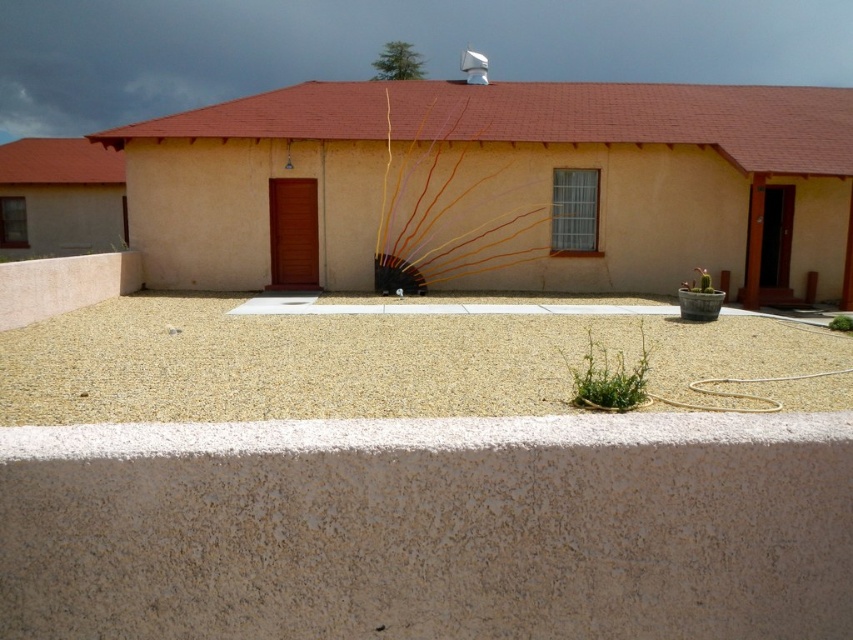
Question: Which point is farther from the camera taking this photo?

Choices:
 (A) (711, 285)
 (B) (842, 314)
 (C) (579, 380)
 (D) (672, 332)

Answer: (B)

Question: Is light beige gravel at center positioned in front of green leafy plant at center?

Choices:
 (A) yes
 (B) no

Answer: (A)

Question: Which point is farther to the camera?

Choices:
 (A) green leafy plant at center
 (B) green leafy plant at lower right
 (C) smooth concrete at center

Answer: (B)

Question: Considering the relative positions of green matte cactus at right and green leafy plant at lower right in the image provided, where is green matte cactus at right located with respect to green leafy plant at lower right?

Choices:
 (A) below
 (B) above

Answer: (B)

Question: Which point is closer to the camera taking this photo?

Choices:
 (A) (840, 317)
 (B) (699, 275)
 (C) (503, 372)
 (D) (36, 538)

Answer: (D)

Question: Does green leafy plant at center appear over green matte cactus at right?

Choices:
 (A) yes
 (B) no

Answer: (B)